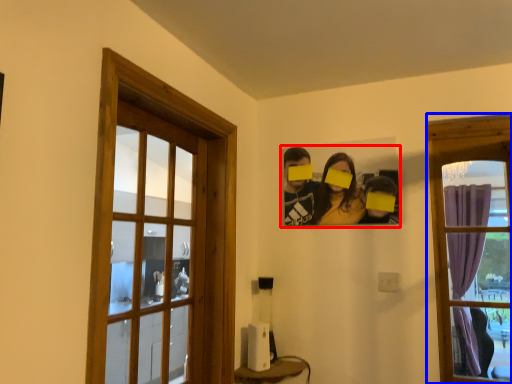
Question: Which point is closer to the camera, couple (highlighted by a red box) or window (highlighted by a blue box)?

Choices:
 (A) couple
 (B) window

Answer: (B)